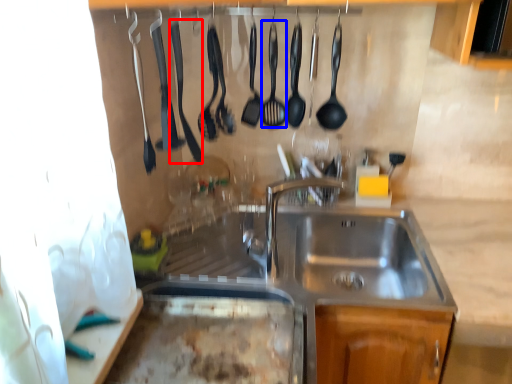
Question: Which object appears farthest to the camera in this image, silverware (highlighted by a red box) or utensil (highlighted by a blue box)?

Choices:
 (A) silverware
 (B) utensil

Answer: (B)